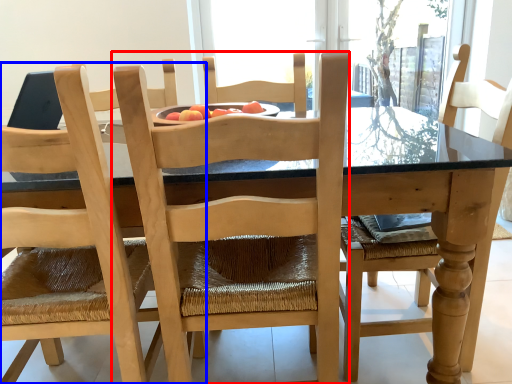
Question: Which object appears farthest to the camera in this image, chair (highlighted by a red box) or chair (highlighted by a blue box)?

Choices:
 (A) chair
 (B) chair

Answer: (A)